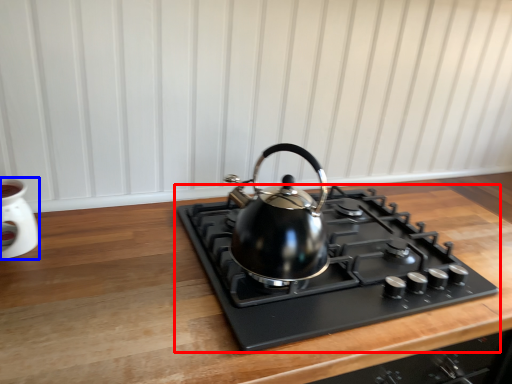
Question: Which object appears closest to the camera in this image, gas stove (highlighted by a red box) or appliance (highlighted by a blue box)?

Choices:
 (A) gas stove
 (B) appliance

Answer: (A)